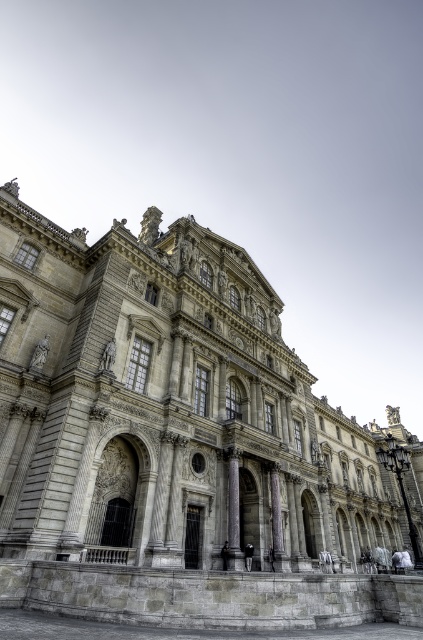
You are an architect designing a new building and want to incorporate elements from this classical structure. If you decide to use both the gray stone palace at center and the smooth gray stone pillar at center in your design, which element should you allocate more space for to maintain proportion?

The gray stone palace at center is larger in size than the smooth gray stone pillar at center, so you should allocate more space for the gray stone palace at center to maintain proportion.